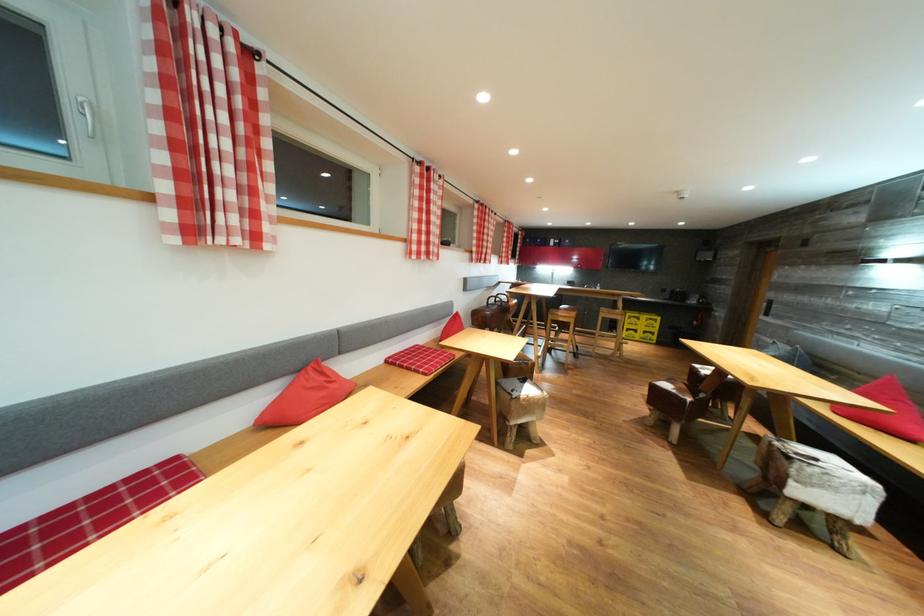
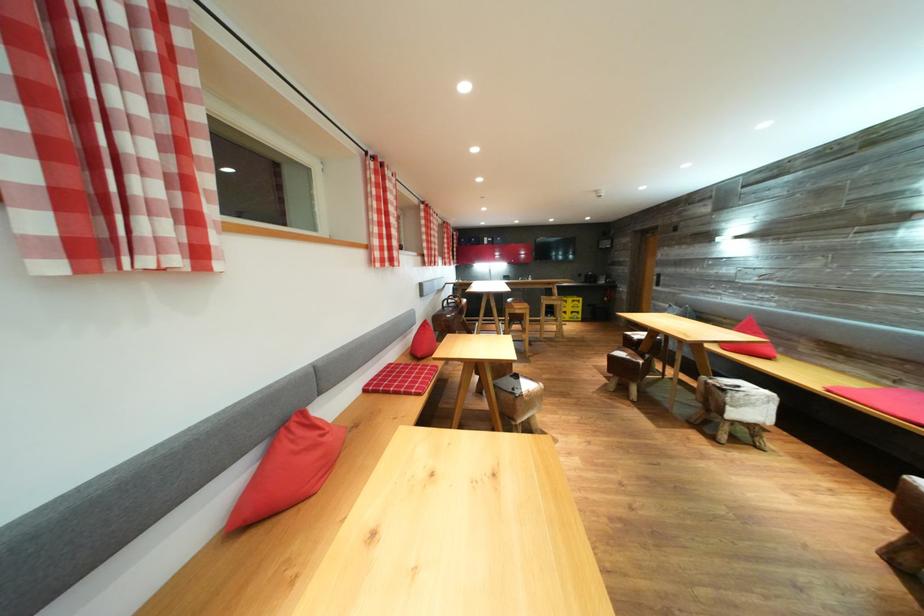
Locate, in the second image, the point that corresponds to the point at 330,378 in the first image.

(320, 431)